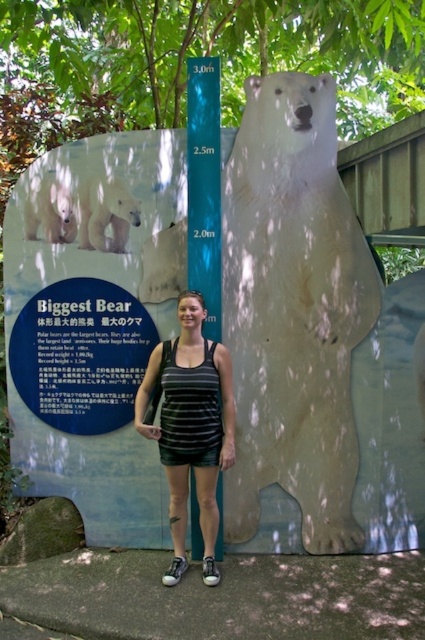
Question: Is translucent plastic polar bear at center to the right of striped fabric tank top at center from the viewer's perspective?

Choices:
 (A) no
 (B) yes

Answer: (B)

Question: Among these objects, which one is farthest from the camera?

Choices:
 (A) white matte polar bear at upper left
 (B) striped fabric tank top at center

Answer: (A)

Question: Is translucent plastic polar bear at center above striped fabric tank top at center?

Choices:
 (A) yes
 (B) no

Answer: (A)

Question: Which point appears farthest from the camera in this image?

Choices:
 (A) (175, 504)
 (B) (102, 179)

Answer: (B)

Question: Which point is closer to the camera?

Choices:
 (A) (223, 305)
 (B) (79, 196)

Answer: (A)

Question: Is striped fabric tank top at center wider than white matte polar bear at upper left?

Choices:
 (A) no
 (B) yes

Answer: (B)